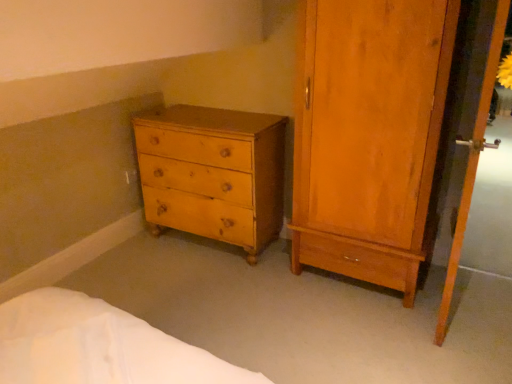
The height and width of the screenshot is (384, 512). What do you see at coordinates (471, 170) in the screenshot? I see `wooden screen door at right` at bounding box center [471, 170].

Locate an element on the screen. Image resolution: width=512 pixels, height=384 pixels. matte wood wardrobe at right is located at coordinates (368, 134).

Is the depth of matte wood wardrobe at right greater than that of wooden screen door at right?

Yes, matte wood wardrobe at right is behind wooden screen door at right.

Which of these two, matte wood wardrobe at right or wooden screen door at right, is smaller?

wooden screen door at right.

From a real-world perspective, relative to wooden screen door at right, is matte wood wardrobe at right vertically above or below?

matte wood wardrobe at right is above wooden screen door at right.

Which is in front, point (460, 222) or point (309, 119)?

The point (460, 222) is closer to the camera.

Visually, is wooden screen door at right positioned to the left or to the right of matte wood wardrobe at right?

In the image, wooden screen door at right appears on the right side of matte wood wardrobe at right.

Locate an element on the screen. Image resolution: width=512 pixels, height=384 pixels. door behind the wooden screen door at right is located at coordinates (368, 134).

Considering the sizes of objects wooden screen door at right and matte wood wardrobe at right in the image provided, who is wider, wooden screen door at right or matte wood wardrobe at right?

matte wood wardrobe at right.

Is wooden screen door at right smaller than light brown wood chest of drawers at lower left?

Yes.

Can you confirm if wooden screen door at right is thinner than light brown wood chest of drawers at lower left?

Indeed, wooden screen door at right has a lesser width compared to light brown wood chest of drawers at lower left.

In the scene shown: From the image's perspective, which one is positioned higher, wooden screen door at right or light brown wood chest of drawers at lower left?

wooden screen door at right is shown above in the image.

Is wooden screen door at right oriented away from light brown wood chest of drawers at lower left?

Yes, light brown wood chest of drawers at lower left is at the back of wooden screen door at right.

Is light brown wood chest of drawers at lower left smaller than wooden screen door at right?

No.

Which is correct: light brown wood chest of drawers at lower left is inside wooden screen door at right, or outside of it?

The correct answer is: outside.

Can you confirm if light brown wood chest of drawers at lower left is taller than wooden screen door at right?

No, light brown wood chest of drawers at lower left is not taller than wooden screen door at right.

Based on the photo, considering the relative sizes of light brown wood chest of drawers at lower left and wooden screen door at right in the image provided, is light brown wood chest of drawers at lower left wider than wooden screen door at right?

Yes, light brown wood chest of drawers at lower left is wider than wooden screen door at right.

In the scene shown: Are matte wood wardrobe at right and light brown wood chest of drawers at lower left beside each other?

No, matte wood wardrobe at right is not making contact with light brown wood chest of drawers at lower left.

In the scene shown: Considering the sizes of objects matte wood wardrobe at right and light brown wood chest of drawers at lower left in the image provided, who is bigger, matte wood wardrobe at right or light brown wood chest of drawers at lower left?

matte wood wardrobe at right is bigger.

From the picture: Is matte wood wardrobe at right not inside light brown wood chest of drawers at lower left?

Yes, matte wood wardrobe at right is outside of light brown wood chest of drawers at lower left.

From the image's perspective, which is above, matte wood wardrobe at right or light brown wood chest of drawers at lower left?

From the image's view, matte wood wardrobe at right is above.

Who is taller, light brown wood chest of drawers at lower left or matte wood wardrobe at right?

matte wood wardrobe at right is taller.

From the image's perspective, is light brown wood chest of drawers at lower left on top of matte wood wardrobe at right?

No, from the image's perspective, light brown wood chest of drawers at lower left is not over matte wood wardrobe at right.

Is light brown wood chest of drawers at lower left oriented towards matte wood wardrobe at right?

No, light brown wood chest of drawers at lower left is not facing towards matte wood wardrobe at right.

Would you say light brown wood chest of drawers at lower left is to the left or to the right of matte wood wardrobe at right in the picture?

light brown wood chest of drawers at lower left is to the left of matte wood wardrobe at right.

At what (x,y) coordinates should I click in order to perform the action: click on screen door in front of the matte wood wardrobe at right. Please return your answer as a coordinate pair (x, y). The height and width of the screenshot is (384, 512). Looking at the image, I should click on (471, 170).

Find the location of a particular element. door behind the wooden screen door at right is located at coordinates (368, 134).

When comparing their distances from light brown wood chest of drawers at lower left, does matte wood wardrobe at right or wooden screen door at right seem further?

Based on the image, wooden screen door at right appears to be further to light brown wood chest of drawers at lower left.

Considering their positions, is matte wood wardrobe at right positioned closer to wooden screen door at right than light brown wood chest of drawers at lower left?

matte wood wardrobe at right lies closer to wooden screen door at right than the other object.

Based on their spatial positions, is wooden screen door at right or matte wood wardrobe at right further from light brown wood chest of drawers at lower left?

Among the two, wooden screen door at right is located further to light brown wood chest of drawers at lower left.

Considering their positions, is light brown wood chest of drawers at lower left positioned further to wooden screen door at right than matte wood wardrobe at right?

light brown wood chest of drawers at lower left is positioned further to the anchor wooden screen door at right.

From the picture: Which object lies further to the anchor point matte wood wardrobe at right, wooden screen door at right or light brown wood chest of drawers at lower left?

Based on the image, light brown wood chest of drawers at lower left appears to be further to matte wood wardrobe at right.

Looking at the image, which one is located further to matte wood wardrobe at right, light brown wood chest of drawers at lower left or wooden screen door at right?

light brown wood chest of drawers at lower left lies further to matte wood wardrobe at right than the other object.

The image size is (512, 384). What are the coordinates of `door between light brown wood chest of drawers at lower left and wooden screen door at right in the horizontal direction` in the screenshot? It's located at (368, 134).